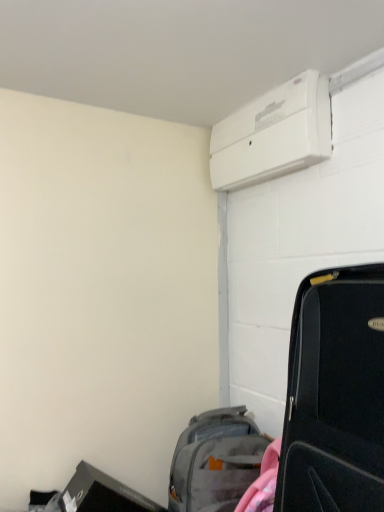
Question: Do you think gray fabric backpack at lower center is within black matte suitcase at right, or outside of it?

Choices:
 (A) inside
 (B) outside

Answer: (B)

Question: Considering the relative positions of gray fabric backpack at lower center and black matte suitcase at right in the image provided, is gray fabric backpack at lower center to the left or to the right of black matte suitcase at right?

Choices:
 (A) right
 (B) left

Answer: (B)

Question: Considering the positions of gray fabric backpack at lower center and black matte suitcase at right in the image, is gray fabric backpack at lower center taller or shorter than black matte suitcase at right?

Choices:
 (A) short
 (B) tall

Answer: (A)

Question: Would you say black matte suitcase at right is inside or outside gray fabric backpack at lower center?

Choices:
 (A) inside
 (B) outside

Answer: (B)

Question: Is black matte suitcase at right taller or shorter than gray fabric backpack at lower center?

Choices:
 (A) tall
 (B) short

Answer: (A)

Question: Considering their positions, is black matte suitcase at right located in front of or behind gray fabric backpack at lower center?

Choices:
 (A) behind
 (B) front

Answer: (B)

Question: Would you say black matte suitcase at right is to the left or to the right of gray fabric backpack at lower center in the picture?

Choices:
 (A) right
 (B) left

Answer: (A)